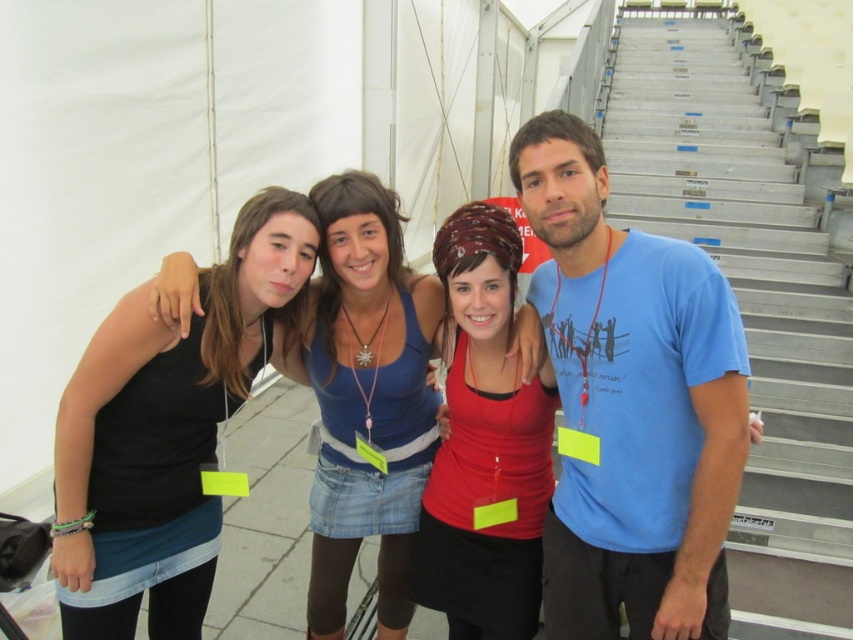
You are standing in front of the group of four people near the white tent. You notice two points in the image labeled as point 1 and point 2. Point 1 is at coordinate (311, 358) and point 2 is at (531, 540). Which point is closer to you?

Point 1 at coordinate (311, 358) is closer to you because it is further to the viewer than point 2 at (531, 540).

You are standing at the center of the image and want to go down the stairs. Which direction should you walk to reach the metallic gray stairs at right located at point (747, 296)?

You should walk to the right to reach the metallic gray stairs at right located at point (747, 296) because the stairs are positioned to the right side of the image.